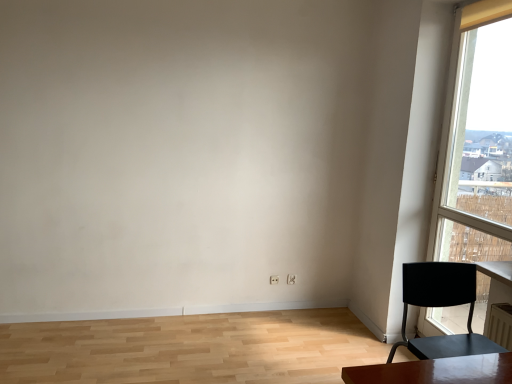
Question: From a real-world perspective, is matte black chair at right positioned above or below transparent glass window at right?

Choices:
 (A) below
 (B) above

Answer: (A)

Question: From the image's perspective, relative to transparent glass window at right, is matte black chair at right above or below?

Choices:
 (A) below
 (B) above

Answer: (A)

Question: Based on their sizes in the image, would you say matte black chair at right is bigger or smaller than transparent glass window at right?

Choices:
 (A) big
 (B) small

Answer: (B)

Question: In terms of height, does transparent glass window at right look taller or shorter compared to matte black chair at right?

Choices:
 (A) short
 (B) tall

Answer: (B)

Question: Does point (480, 104) appear closer or farther from the camera than point (442, 299)?

Choices:
 (A) closer
 (B) farther

Answer: (B)

Question: From a real-world perspective, relative to matte black chair at right, is transparent glass window at right vertically above or below?

Choices:
 (A) above
 (B) below

Answer: (A)

Question: Based on their sizes in the image, would you say transparent glass window at right is bigger or smaller than matte black chair at right?

Choices:
 (A) big
 (B) small

Answer: (A)